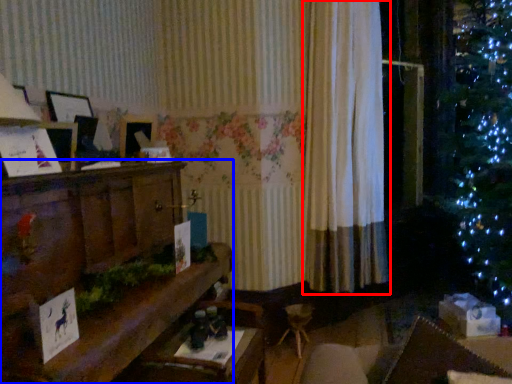
Question: Among these objects, which one is farthest to the camera, curtain (highlighted by a red box) or furniture (highlighted by a blue box)?

Choices:
 (A) curtain
 (B) furniture

Answer: (A)